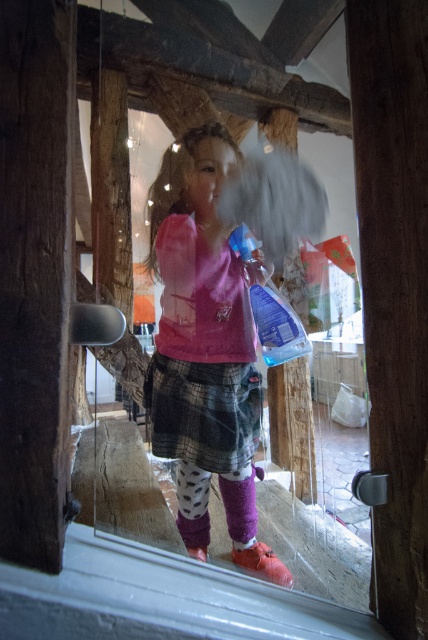
You are a delivery person trying to place a small package on the floor near the brown wooden door at center and the purple fuzzy sock at lower center. Which object should you place the package closer to if you want it to be near the smaller object?

You should place the package closer to the purple fuzzy sock at lower center because it is smaller than the brown wooden door at center.

You are a visitor trying to enter the rustic wooden structure. You see the brown wooden door at center and the transparent plastic bottle at center. Which object should you approach first to enter the building?

The brown wooden door at center is positioned on the right side of transparent plastic bottle at center, so you should approach the brown wooden door at center first to enter the building.

You are a delivery person trying to enter the building through the brown wooden door at center. There is a patterned fabric sock at lower center blocking your path. Can you step over it without opening the door?

The brown wooden door at center is taller than the patterned fabric sock at lower center, so yes, you can step over the patterned fabric sock at lower center since it is shorter than the door.